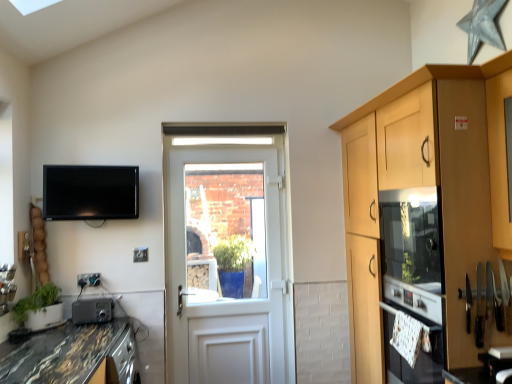
Question: Would you say matte wood oven at right is inside or outside clear glass door at center?

Choices:
 (A) inside
 (B) outside

Answer: (B)

Question: Is matte wood oven at right to the left or to the right of clear glass door at center in the image?

Choices:
 (A) left
 (B) right

Answer: (B)

Question: Which of these objects is positioned closest to the marble/black granite countertop at lower left?

Choices:
 (A) metallic gray radio at lower left
 (B) matte wood oven at right
 (C) white glossy oven at lower right
 (D) clear glass door at center
 (E) matte black tv at upper left

Answer: (A)

Question: Estimate the real-world distances between objects in this image. Which object is farther from the green matte plant at lower left?

Choices:
 (A) white glossy oven at lower right
 (B) matte black tv at upper left
 (C) marble/black granite countertop at lower left
 (D) clear glass door at center
 (E) matte wood oven at right

Answer: (E)